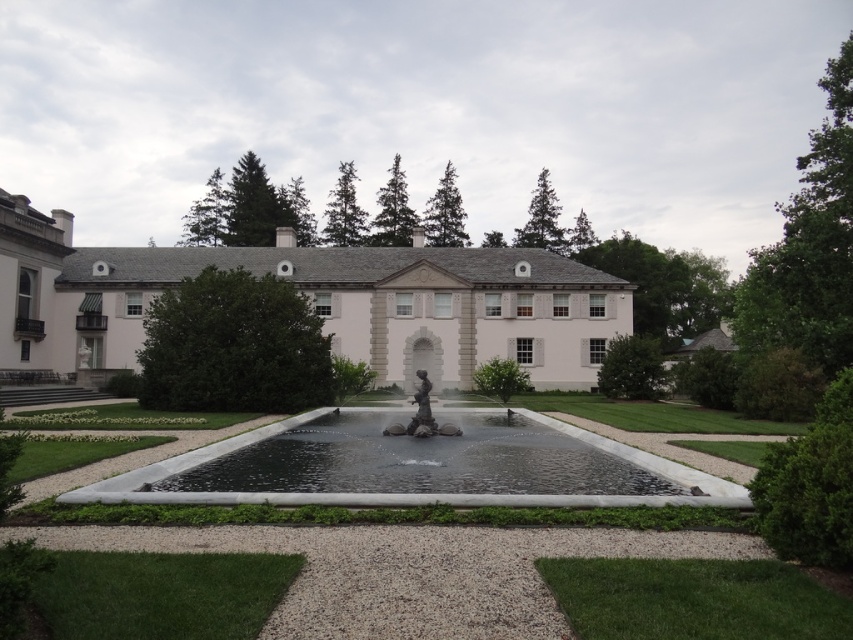
You are a tour guide leading a group to the white stone mansion at center. You notice the clear glass water at center is in the way. Can your group walk around it to reach the mansion?

The distance between the white stone mansion at center and the clear glass water at center is 33.36 meters, so yes, the group can walk around the clear glass water at center to reach the white stone mansion at center since there is enough space between them.

You are a visitor approaching the white stone mansion at center and the clear glass water at center. Which object will appear bigger to you as you walk closer?

The white stone mansion at center will appear bigger as you approach because it has a larger size compared to the clear glass water at center.

Consider the image. You are standing at the fountain with the statue in the center. You want to walk directly to the entrance of the white stone mansion at center. Which direction should you walk?

You should walk towards the entrance of the white stone mansion at center, which is located at point (312,301). Since you are at the fountain, which is the central feature, you would need to walk towards the building. However, the exact direction depends on the layout. Based on the coordinates, the mansion is at the center, so moving towards it from the fountain would generally be towards the building itself.